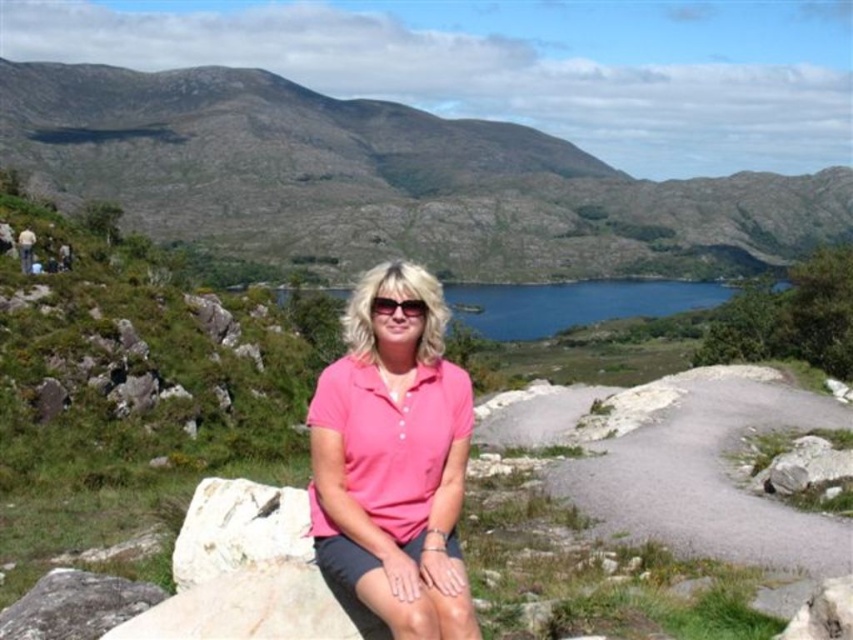
You are a hiker who wants to take a photo of the blue glassy water at center and the green grassy hillside at upper center. Which object should you focus on first if you want to capture both in one shot without moving the camera?

The green grassy hillside at upper center is taller than the blue glassy water at center, so you should focus on the green grassy hillside at upper center first to ensure both are in focus.

You are a photographer trying to capture the reflection of the person sitting on the rock in the blue glassy water at center. Based on the scene description, can you determine if the reflection will be visible in the water?

The blue glassy water at center is at point (x=573, y=301), so the reflection of the person sitting on the rock will be visible in the water because the water is glassy and flat, which allows for clear reflections.

Looking at this image, you are standing at the point with coordinates point (x=305, y=496) and want to walk to point (x=68, y=573). Which direction should you move in to get closer to your destination?

You should move away from the viewer because point (x=305, y=496) is further to the viewer than point (x=68, y=573).